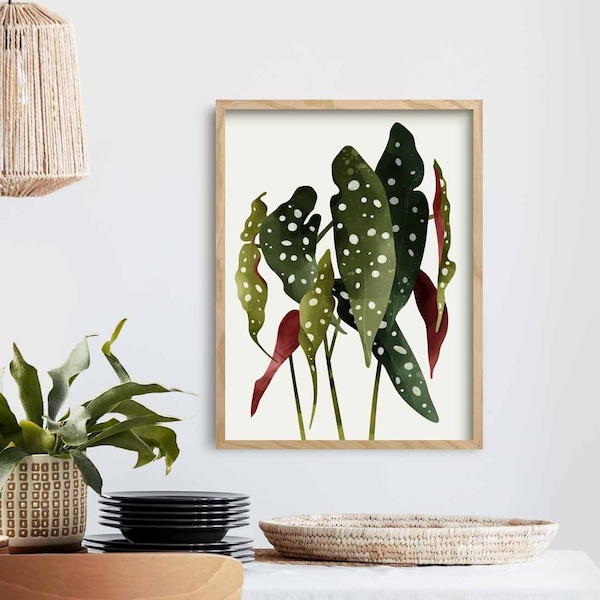
This screenshot has width=600, height=600. I want to click on chair, so click(195, 582).